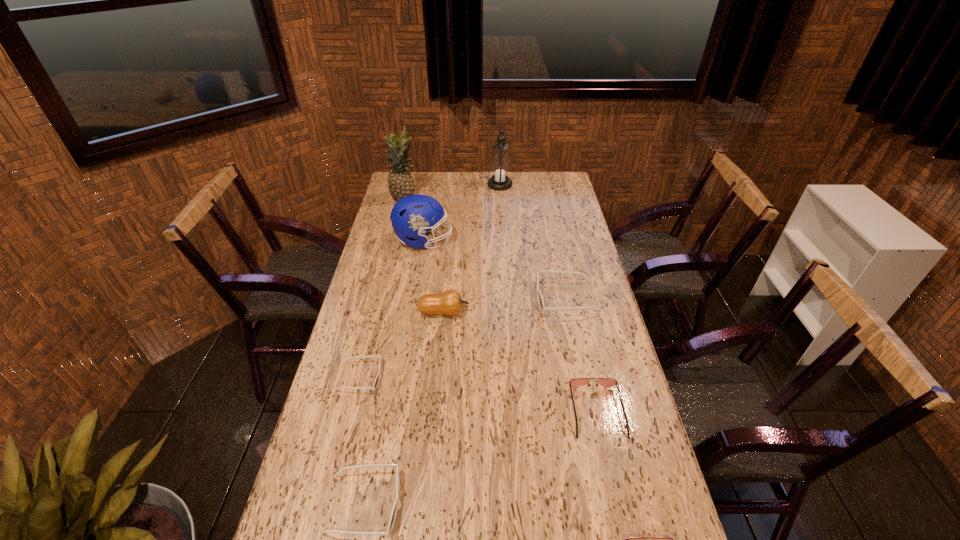
I want to click on vacant space located 0.090m on the right of the green pineapple, so click(x=439, y=199).

I want to click on vacant area situated 0.270m on the face guard of the blue football helmet, so click(518, 241).

The image size is (960, 540). Identify the location of vacant space located 0.150m on the stem side of the gourd. (513, 312).

Image resolution: width=960 pixels, height=540 pixels. I want to click on free space located with the lenses of the fifth shortest object facing outward, so click(445, 298).

Find the location of a particular element. Image resolution: width=960 pixels, height=540 pixels. vacant space positioned with the lenses of the fifth shortest object facing outward is located at coordinates (505, 298).

The image size is (960, 540). Find the location of `vacant area situated 0.260m with the lenses of the fifth shortest object facing outward`. vacant area situated 0.260m with the lenses of the fifth shortest object facing outward is located at coordinates (462, 298).

Where is `vacant region located 0.070m on the bridge of the bigger pink sunglasses`? Image resolution: width=960 pixels, height=540 pixels. vacant region located 0.070m on the bridge of the bigger pink sunglasses is located at coordinates (609, 465).

Where is `vacant position located 0.280m with the lenses of the second farthest black sunglasses facing outward`? vacant position located 0.280m with the lenses of the second farthest black sunglasses facing outward is located at coordinates (476, 377).

This screenshot has height=540, width=960. Find the location of `oil lamp present at the far edge`. oil lamp present at the far edge is located at coordinates (500, 166).

The height and width of the screenshot is (540, 960). What are the coordinates of `pineapple that is at the far edge` in the screenshot? It's located at (400, 181).